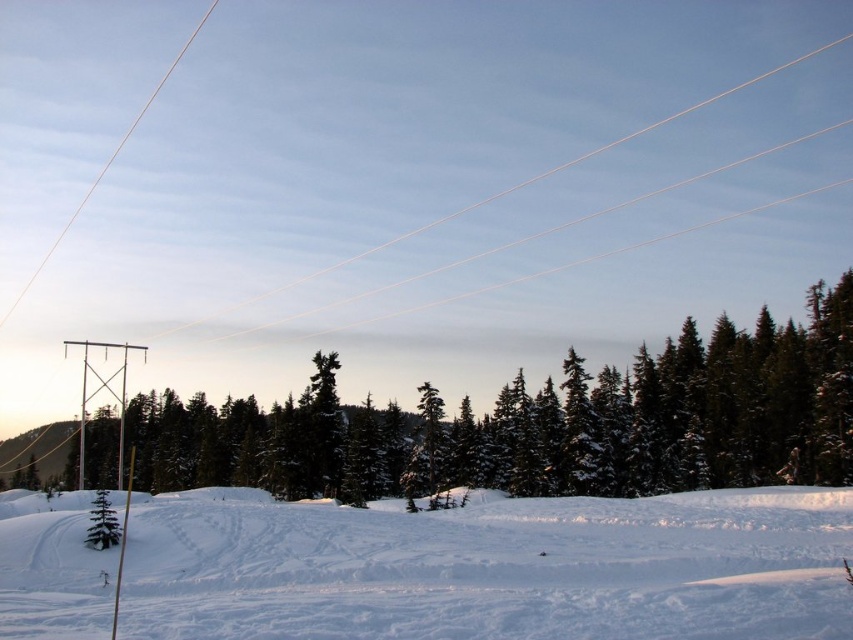
Does white powdery snow at lower center have a greater width compared to green matte tree at lower left?

Correct, the width of white powdery snow at lower center exceeds that of green matte tree at lower left.

Is point (254, 528) positioned behind point (96, 547)?

Yes, point (254, 528) is behind point (96, 547).

The width and height of the screenshot is (853, 640). Identify the location of white powdery snow at lower center. (492, 568).

Is green matte tree at center in front of white wire at upper left?

That is True.

Looking at this image, is green matte tree at center further to camera compared to white wire at upper left?

No, it is in front of white wire at upper left.

Does point (795, 368) lie behind point (111, 154)?

No, (795, 368) is in front of (111, 154).

This screenshot has width=853, height=640. I want to click on green matte tree at center, so 541,424.

Is green matte tree at center thinner than white wire at upper center?

Yes.

Locate an element on the screen. green matte tree at center is located at coordinates (541, 424).

Where is `green matte tree at center`? Image resolution: width=853 pixels, height=640 pixels. green matte tree at center is located at coordinates (541, 424).